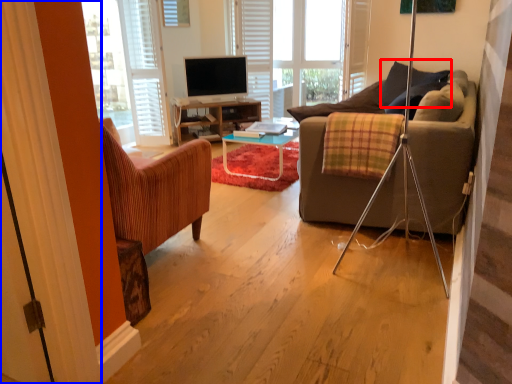
Question: Among these objects, which one is farthest to the camera, pillow (highlighted by a red box) or curtain (highlighted by a blue box)?

Choices:
 (A) pillow
 (B) curtain

Answer: (A)